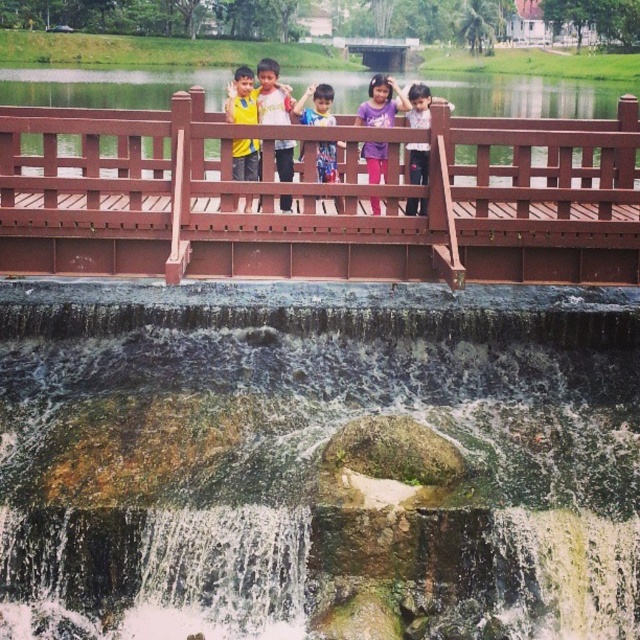
Question: Which point is farther to the camera?

Choices:
 (A) (257, 113)
 (B) (372, 145)

Answer: (A)

Question: Which point appears closest to the camera in this image?

Choices:
 (A) (124, 588)
 (B) (378, 179)
 (C) (422, 118)

Answer: (A)

Question: Is purple cotton shirt at center to the right of multicolored shirt at center from the viewer's perspective?

Choices:
 (A) no
 (B) yes

Answer: (B)

Question: Is the position of brown wooden bridge at center more distant than that of multicolored shirt at center?

Choices:
 (A) no
 (B) yes

Answer: (A)

Question: Which of the following is the closest to the observer?

Choices:
 (A) (541, 262)
 (B) (289, 120)

Answer: (A)

Question: Is yellow matte shirt at center wider than matte white shirt at center?

Choices:
 (A) yes
 (B) no

Answer: (A)